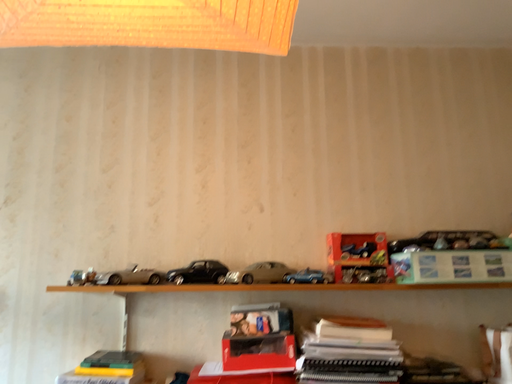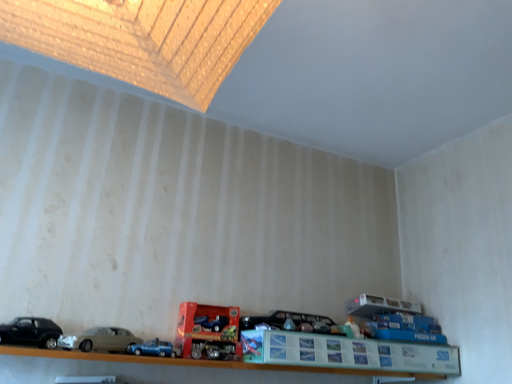
Question: How did the camera likely rotate when shooting the video?

Choices:
 (A) rotated downward
 (B) rotated upward

Answer: (B)